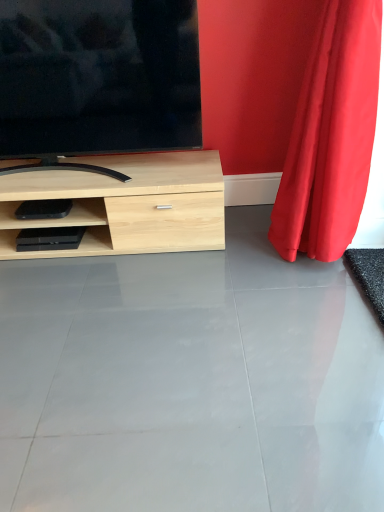
What are the coordinates of `blank space to the left of red velvet curtain at right` in the screenshot? It's located at 236,270.